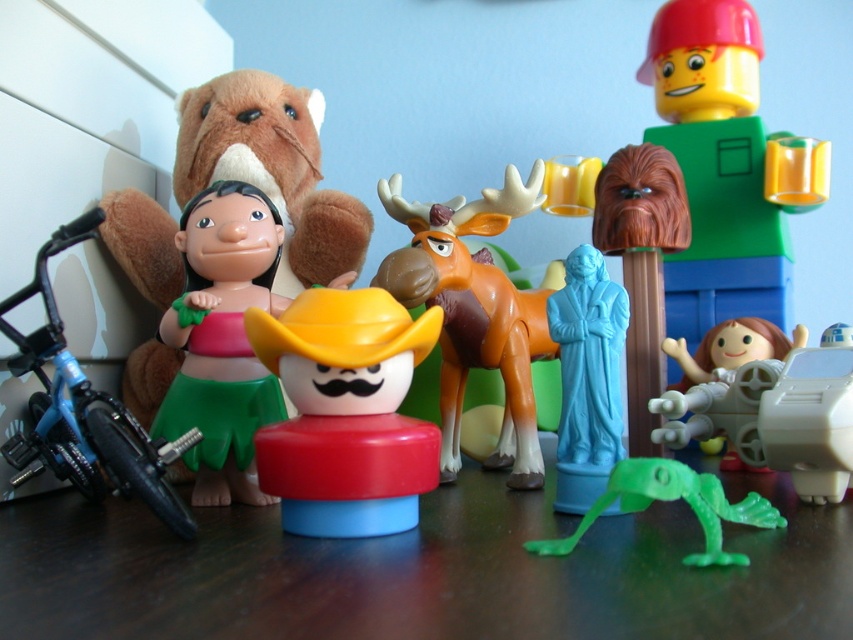
Describe the element at coordinates (222, 339) in the screenshot. This screenshot has width=853, height=640. I see `green matte hula dancer at center` at that location.

Is green matte hula dancer at center thinner than blue metallic bicycle at left?

Yes, green matte hula dancer at center is thinner than blue metallic bicycle at left.

Which is in front, point (239, 291) or point (96, 216)?

Point (96, 216) is more forward.

Locate an element on the screen. The height and width of the screenshot is (640, 853). green matte hula dancer at center is located at coordinates (222, 339).

Between brown fuzzy tree at upper right and green matte lizard at lower center, which one is positioned higher?

Positioned higher is brown fuzzy tree at upper right.

Describe the element at coordinates (641, 266) in the screenshot. I see `brown fuzzy tree at upper right` at that location.

Is point (648, 387) positioned in front of point (711, 509)?

That is False.

This screenshot has width=853, height=640. What are the coordinates of `brown fuzzy tree at upper right` in the screenshot? It's located at (641, 266).

Which of these two, blue metallic bicycle at left or white plastic toy at lower right, stands shorter?

white plastic toy at lower right is shorter.

Is blue metallic bicycle at left to the right of white plastic toy at lower right from the viewer's perspective?

Incorrect, blue metallic bicycle at left is not on the right side of white plastic toy at lower right.

Is point (50, 294) farther from camera compared to point (816, 406)?

No, it is not.

Where is `blue metallic bicycle at left`? Image resolution: width=853 pixels, height=640 pixels. blue metallic bicycle at left is located at coordinates [84, 410].